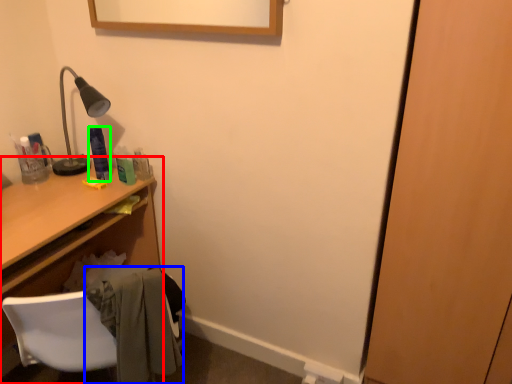
Question: Considering the real-world distances, which object is closest to desk (highlighted by a red box)? clothe (highlighted by a blue box) or toiletry (highlighted by a green box).

Choices:
 (A) clothe
 (B) toiletry

Answer: (B)